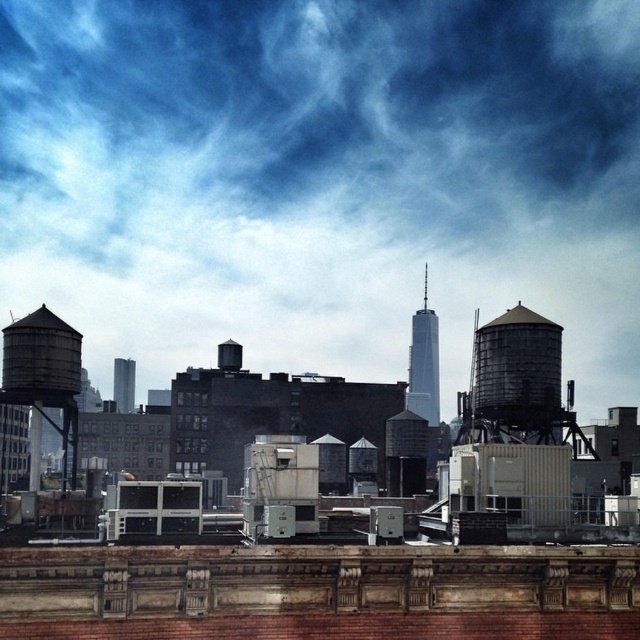
Question: Does cloudy sky at upper center appear under rustic metal water tower at right?

Choices:
 (A) no
 (B) yes

Answer: (A)

Question: In this image, where is cloudy sky at upper center located relative to metallic silver water tower at center?

Choices:
 (A) left
 (B) right

Answer: (A)

Question: Which point is closer to the camera?

Choices:
 (A) tap(476, 401)
 (B) tap(580, 184)
 (C) tap(413, 358)

Answer: (A)

Question: Among these objects, which one is farthest from the camera?

Choices:
 (A) rustic metal water tower at right
 (B) metallic silver water tower at center

Answer: (B)

Question: Can you confirm if rustic metal water tower at right is positioned to the left of metallic silver water tower at center?

Choices:
 (A) no
 (B) yes

Answer: (B)

Question: Which point is closer to the camera?

Choices:
 (A) cloudy sky at upper center
 (B) metallic silver water tower at center
 (C) rustic metal water tower at right

Answer: (C)